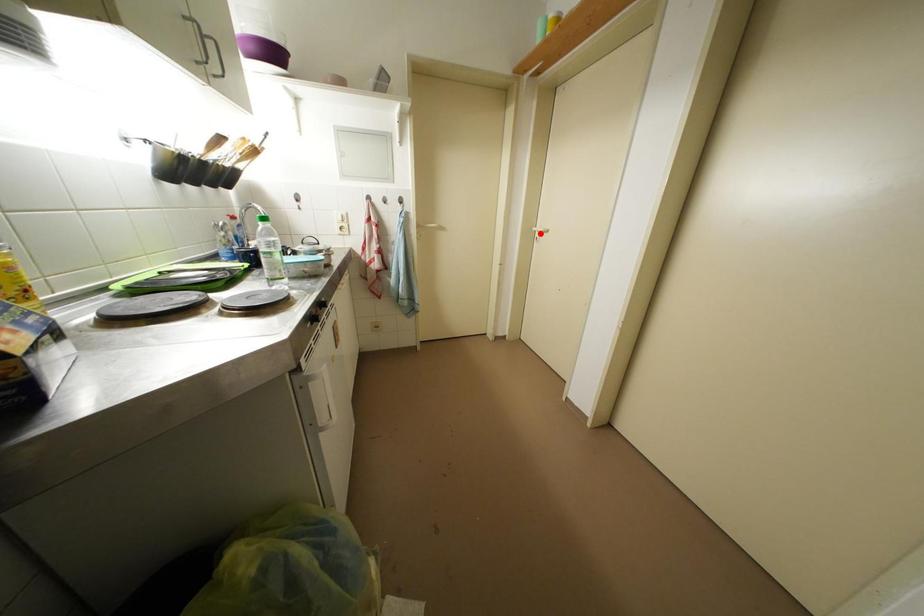
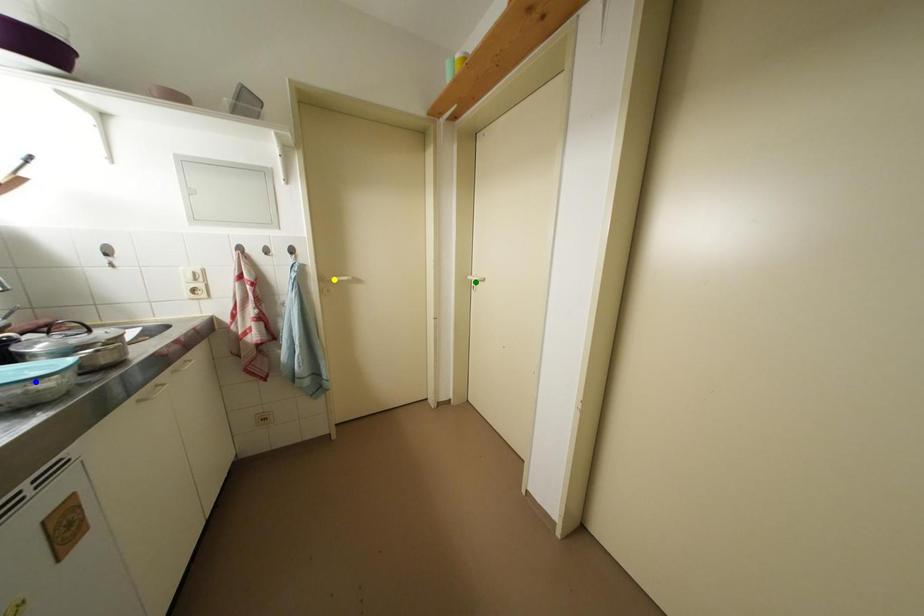
Question: I am providing you with two images of the same scene from different viewpoints. A red point is marked on the first image. You are given multiple points on the second image. Which spot in image 2 lines up with the point in image 1?

Choices:
 (A) yellow point
 (B) green point
 (C) blue point

Answer: (B)